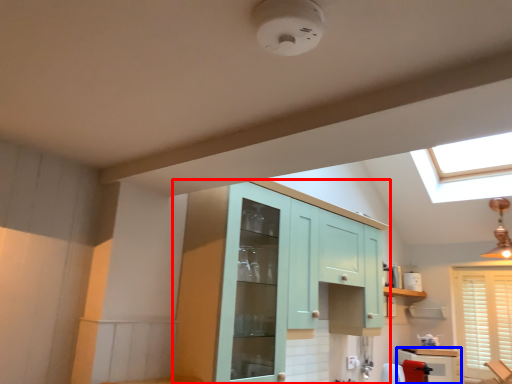
Question: Which point is further to the camera, cabinetry (highlighted by a red box) or cabinetry (highlighted by a blue box)?

Choices:
 (A) cabinetry
 (B) cabinetry

Answer: (B)